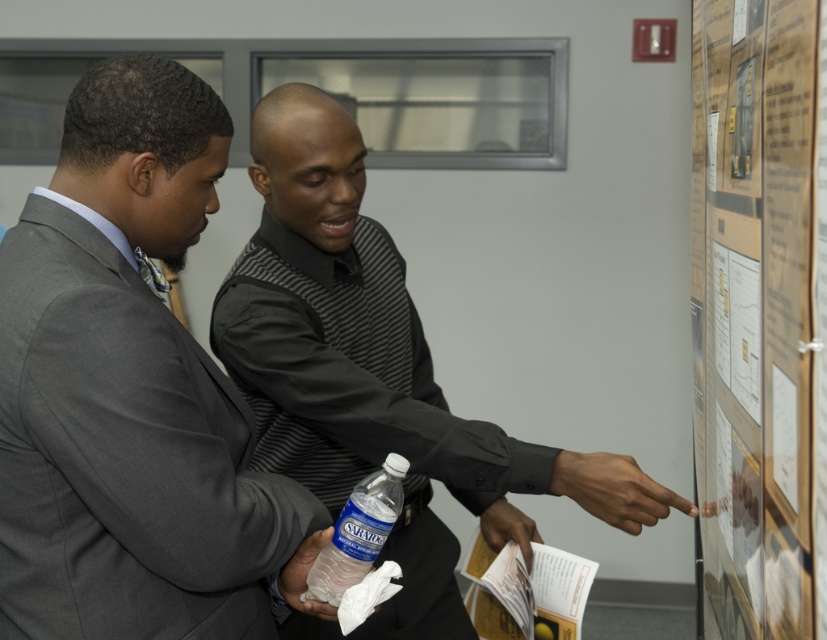
Question: Is paperboard poster at right below translucent plastic water bottle at lower center?

Choices:
 (A) no
 (B) yes

Answer: (A)

Question: Is gray suit at left thinner than black matte shirt at center?

Choices:
 (A) yes
 (B) no

Answer: (A)

Question: Can you confirm if paperboard poster at right is positioned above translucent plastic water bottle at lower center?

Choices:
 (A) no
 (B) yes

Answer: (B)

Question: Among these points, which one is nearest to the camera?

Choices:
 (A) (716, 404)
 (B) (175, 628)
 (C) (337, 596)

Answer: (A)

Question: Among these points, which one is farthest from the camera?

Choices:
 (A) [414, 426]
 (B) [373, 534]
 (C) [796, 216]

Answer: (A)

Question: Which object is closer to the camera taking this photo?

Choices:
 (A) translucent plastic water bottle at lower center
 (B) gray suit at left

Answer: (B)